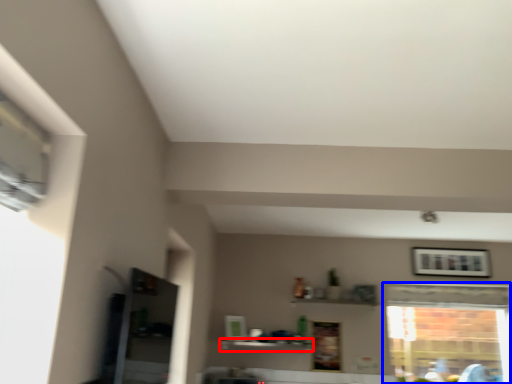
Question: Which object appears closest to the camera in this image, shelf (highlighted by a red box) or window (highlighted by a blue box)?

Choices:
 (A) shelf
 (B) window

Answer: (A)